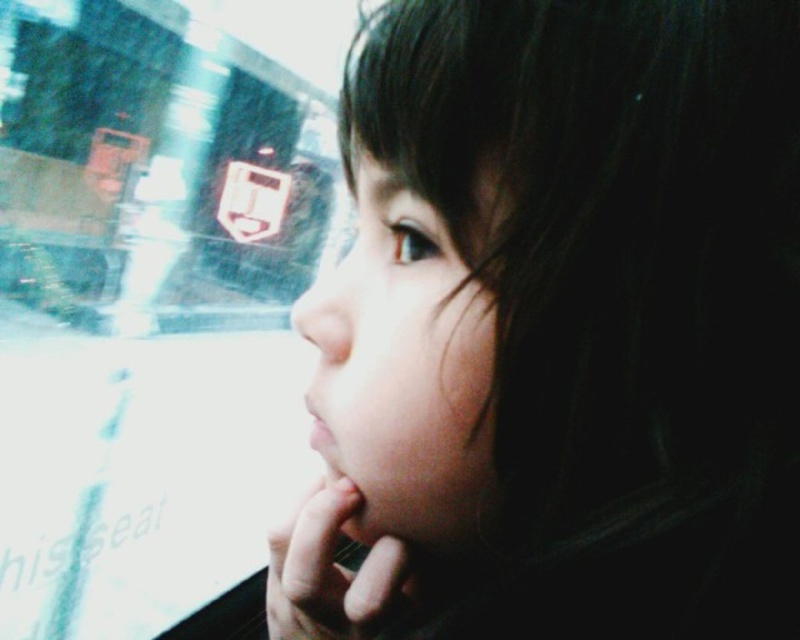
Question: Can you confirm if dark hair at upper right is positioned to the left of transparent glass train window at upper left?

Choices:
 (A) no
 (B) yes

Answer: (A)

Question: Is the position of dark hair at upper right less distant than that of transparent glass train window at upper left?

Choices:
 (A) yes
 (B) no

Answer: (A)

Question: Which object is closer to the camera taking this photo?

Choices:
 (A) dark hair at upper right
 (B) transparent glass train window at upper left

Answer: (A)

Question: Is dark hair at upper right above transparent glass train window at upper left?

Choices:
 (A) yes
 (B) no

Answer: (A)

Question: Among these objects, which one is nearest to the camera?

Choices:
 (A) dark hair at upper right
 (B) transparent glass train window at upper left

Answer: (A)